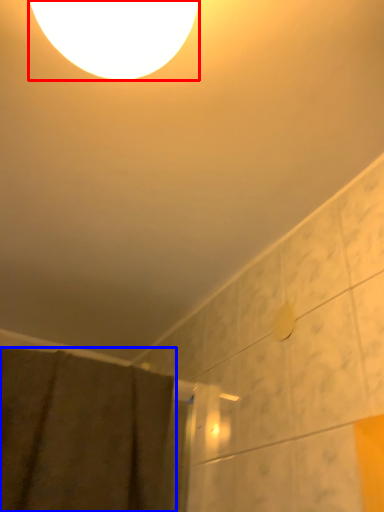
Question: Which object is closer to the camera taking this photo, lamp (highlighted by a red box) or shower curtain (highlighted by a blue box)?

Choices:
 (A) lamp
 (B) shower curtain

Answer: (A)